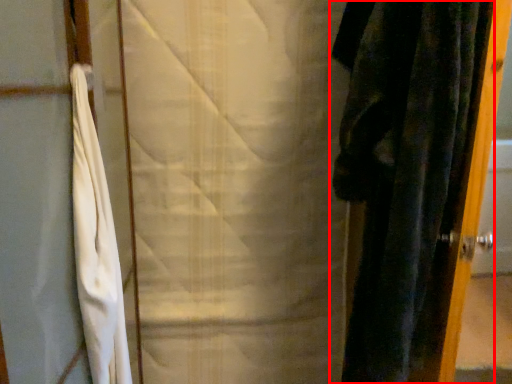
Question: Observing the image, what is the correct spatial positioning of curtain (annotated by the red box) in reference to curtain?

Choices:
 (A) right
 (B) left

Answer: (A)